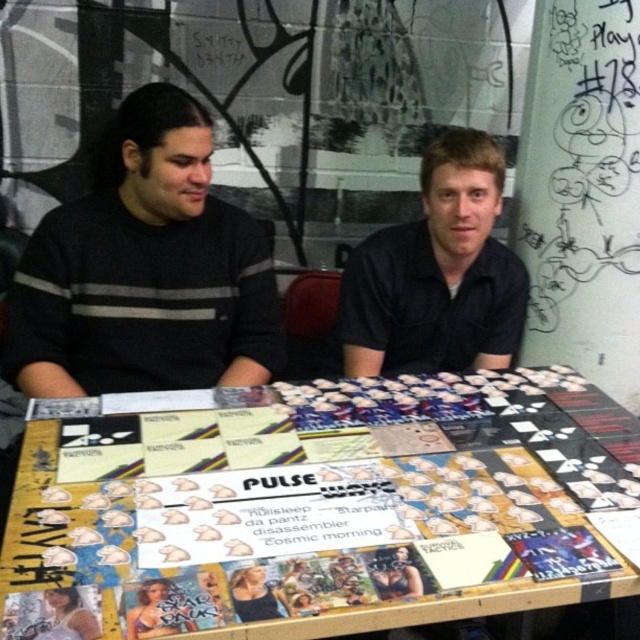
Question: Is wooden board game at center further to the viewer compared to black matte shirt at center?

Choices:
 (A) no
 (B) yes

Answer: (A)

Question: Which point is farther to the camera?

Choices:
 (A) black striped sweater at left
 (B) wooden board game at center
 (C) black matte shirt at center

Answer: (C)

Question: Which point is farther from the camera taking this photo?

Choices:
 (A) (419, 237)
 (B) (620, 516)

Answer: (A)

Question: Can you confirm if wooden board game at center is positioned below black striped sweater at left?

Choices:
 (A) no
 (B) yes

Answer: (B)

Question: Does wooden board game at center have a smaller size compared to black matte shirt at center?

Choices:
 (A) no
 (B) yes

Answer: (A)

Question: Which of the following is the farthest from the observer?

Choices:
 (A) black matte shirt at center
 (B) wooden board game at center
 (C) black striped sweater at left

Answer: (A)